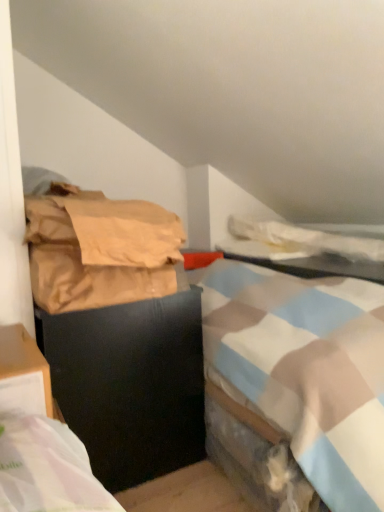
Where is `vacant space underneath brown paper bag at left (from a real-world perspective)`? The image size is (384, 512). vacant space underneath brown paper bag at left (from a real-world perspective) is located at coordinates (112, 302).